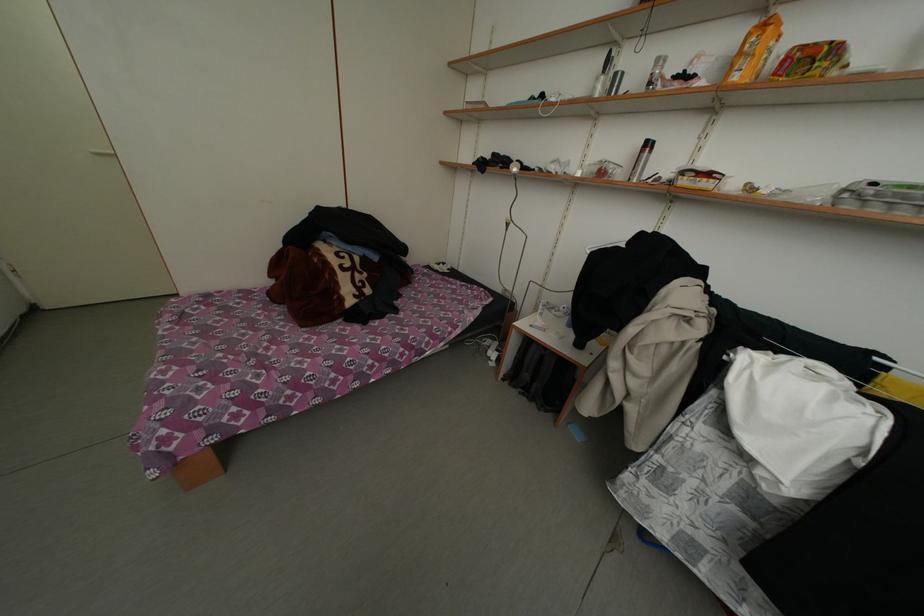
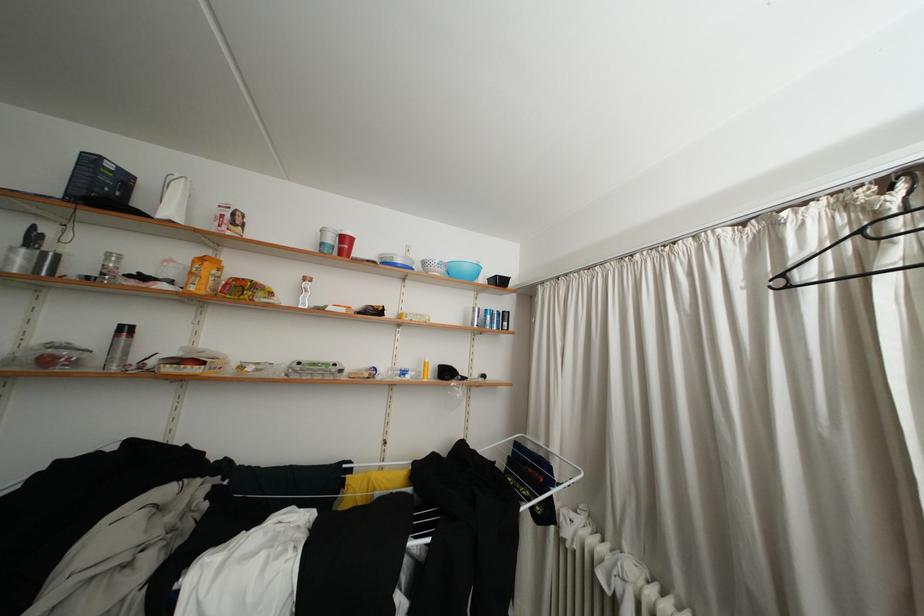
Locate, in the second image, the point that corresponds to (x=602, y=94) in the first image.

(17, 264)